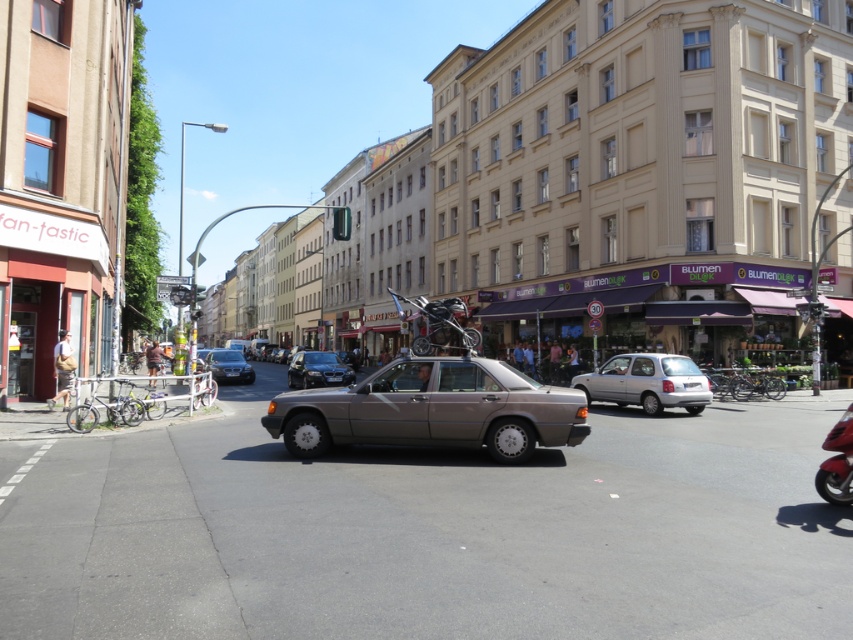
Question: Is silver metallic hatchback at center positioned before matte black car at center?

Choices:
 (A) yes
 (B) no

Answer: (A)

Question: Which object is positioned closest to the matte black sedan at center?

Choices:
 (A) matte black car at center
 (B) silver metallic hatchback at center

Answer: (A)

Question: Which point is closer to the camera?

Choices:
 (A) matte black car at center
 (B) silver metallic hatchback at center
 (C) matte black sedan at center
 (D) satin silver car at center

Answer: (D)

Question: In this image, where is satin silver car at center located relative to shiny red motorcycle at lower right?

Choices:
 (A) left
 (B) right

Answer: (A)

Question: Does shiny chrome motorbike at center have a smaller size compared to matte black car at center?

Choices:
 (A) no
 (B) yes

Answer: (A)

Question: Which is nearer to the matte black sedan at center?

Choices:
 (A) shiny chrome motorbike at center
 (B) silver metallic hatchback at center

Answer: (A)